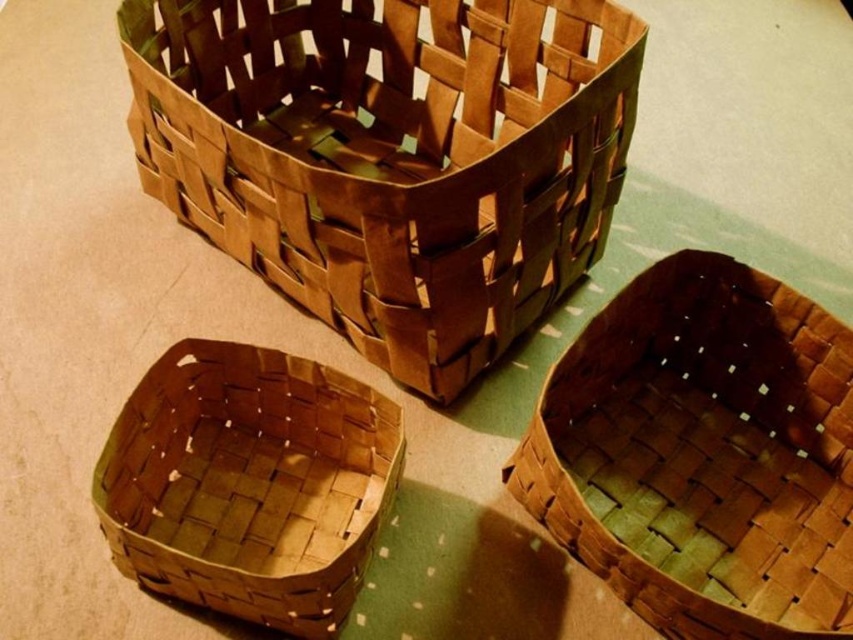
Question: Which point is closer to the camera?

Choices:
 (A) brown woven basket at upper center
 (B) brown woven basket at lower left
 (C) brown woven basket at center

Answer: (C)

Question: Which point is closer to the camera taking this photo?

Choices:
 (A) (442, 330)
 (B) (241, 380)
 (C) (635, 312)

Answer: (A)

Question: Which point is closer to the camera taking this photo?

Choices:
 (A) (669, 394)
 (B) (339, 429)

Answer: (B)

Question: Can you confirm if brown woven basket at center is positioned below brown woven basket at lower left?

Choices:
 (A) no
 (B) yes

Answer: (A)

Question: Is the position of brown woven basket at upper center more distant than that of brown woven basket at center?

Choices:
 (A) yes
 (B) no

Answer: (A)

Question: Can you confirm if brown woven basket at center is bigger than brown woven basket at lower left?

Choices:
 (A) yes
 (B) no

Answer: (A)